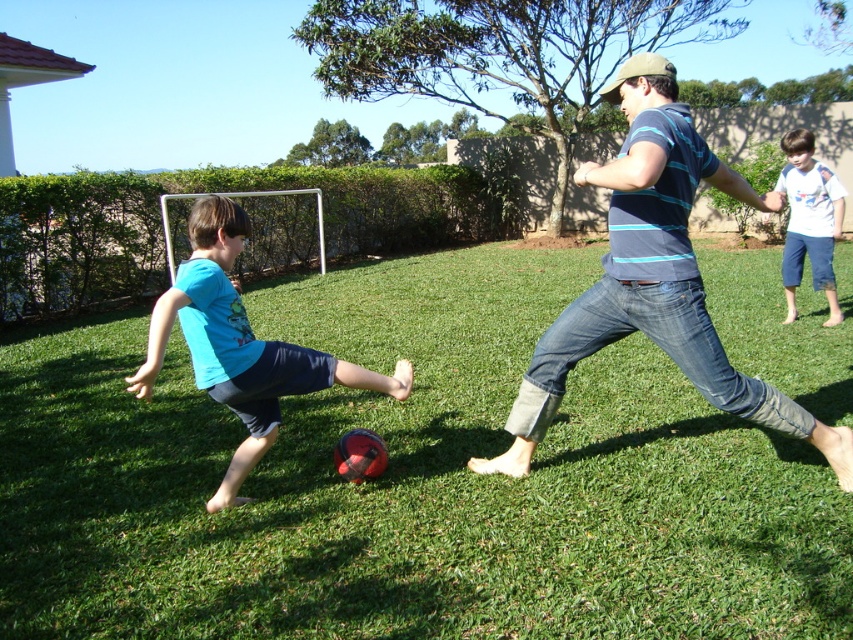
Question: Does blue striped shirt at center appear on the left side of white cotton shirt at upper right?

Choices:
 (A) no
 (B) yes

Answer: (B)

Question: Which point is closer to the camera?

Choices:
 (A) (291, 353)
 (B) (503, 458)
 (C) (437, 381)

Answer: (A)

Question: Is blue striped shirt at center in front of white cotton shirt at upper right?

Choices:
 (A) yes
 (B) no

Answer: (A)

Question: Which point appears closest to the camera in this image?

Choices:
 (A) (666, 328)
 (B) (816, 257)
 (C) (213, 365)

Answer: (C)

Question: Which object is farther from the camera taking this photo?

Choices:
 (A) blue matte shirt at lower left
 (B) green grass at center
 (C) blue striped shirt at center
 (D) white cotton shirt at upper right

Answer: (D)

Question: Observing the image, what is the correct spatial positioning of blue striped shirt at center in reference to blue matte shirt at lower left?

Choices:
 (A) above
 (B) below

Answer: (A)